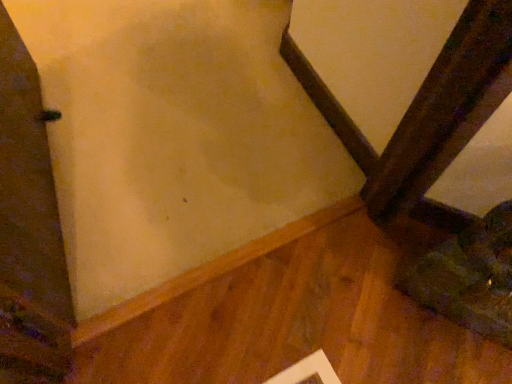
Locate an element on the screen. unoccupied area behind white matte paper at lower center is located at coordinates (321, 326).